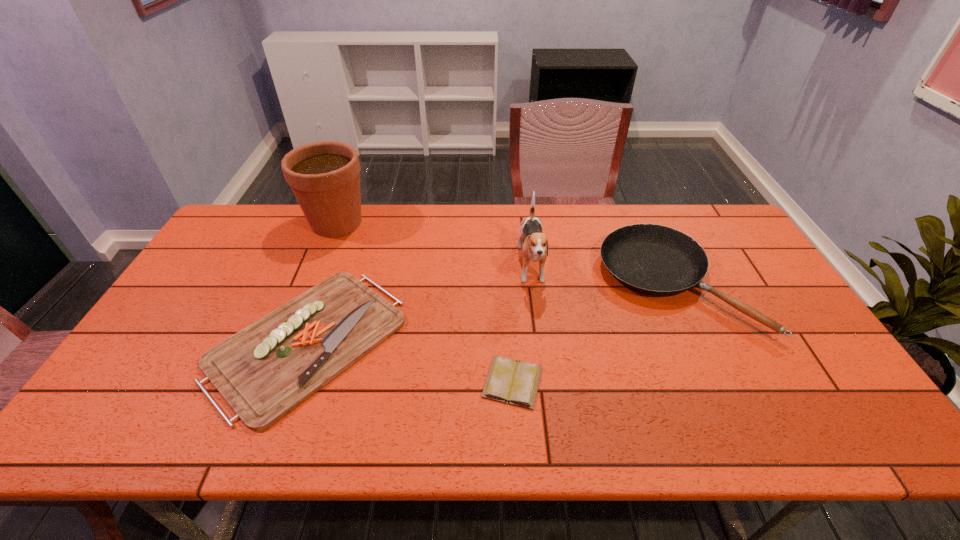
What are the coordinates of `flowerpot` in the screenshot? It's located at (324, 176).

You are a GUI agent. You are given a task and a screenshot of the screen. Output one action in this format:
    pyautogui.click(x=<x>, y=<y>)
    Task: Click on the second tallest object
    
    Given the screenshot: What is the action you would take?
    pyautogui.click(x=535, y=248)

Find the location of a particular element. frying pan is located at coordinates (657, 260).

Where is `the rightmost object`? This screenshot has width=960, height=540. the rightmost object is located at coordinates (657, 260).

Locate an element on the screen. This screenshot has height=540, width=960. chopping board is located at coordinates (264, 371).

Locate an element on the screen. Image resolution: width=960 pixels, height=540 pixels. the shortest object is located at coordinates (513, 382).

Where is `vacant space positioned 0.400m on the front of the flowerpot`? vacant space positioned 0.400m on the front of the flowerpot is located at coordinates 291,338.

Find the location of a particular element. free space located at the face of the second tallest object is located at coordinates (550, 415).

Where is `free space located on the left of the third shortest object`? The height and width of the screenshot is (540, 960). free space located on the left of the third shortest object is located at coordinates (576, 284).

Identify the location of free location located on the right of the chopping board. (541, 341).